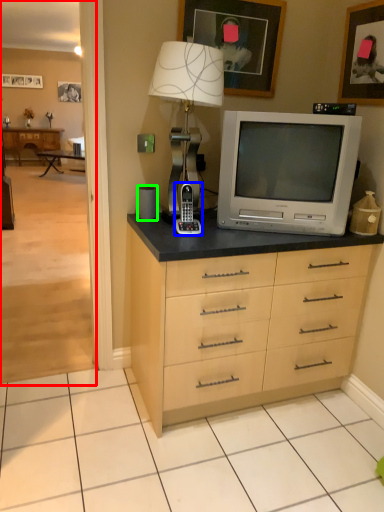
Question: Which object is positioned closest to corridor (highlighted by a red box)? Select from appliance (highlighted by a blue box) and speaker (highlighted by a green box).

Choices:
 (A) appliance
 (B) speaker

Answer: (A)